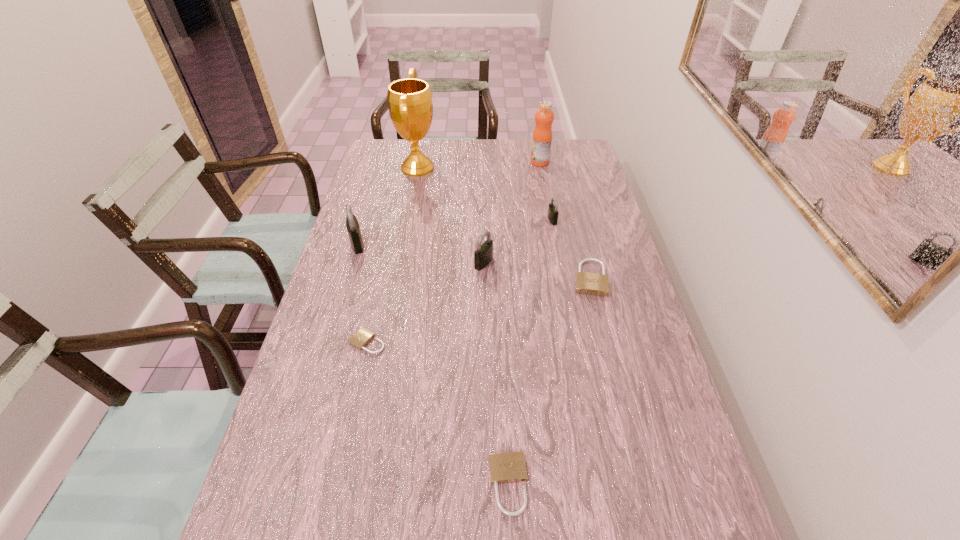
Find the location of a particular element. The image size is (960, 540). the fourth tallest padlock is located at coordinates tap(588, 283).

Identify the location of the second beige padlock from left to right. The height and width of the screenshot is (540, 960). (509, 467).

I want to click on the second shortest object, so click(509, 467).

Image resolution: width=960 pixels, height=540 pixels. Find the location of `the fifth farthest padlock`. the fifth farthest padlock is located at coordinates (363, 336).

At what (x,y) coordinates should I click in order to perform the action: click on the second nearest object. Please return your answer as a coordinate pair (x, y). Image resolution: width=960 pixels, height=540 pixels. Looking at the image, I should click on (363, 336).

This screenshot has height=540, width=960. What are the coordinates of `free spot located on the front-facing side of the tallest object` in the screenshot? It's located at (455, 168).

You are a GUI agent. You are given a task and a screenshot of the screen. Output one action in this format:
    pyautogui.click(x=<x>, y=<y>)
    Task: Click on the vacant space located on the left of the fruit juice
    The width and height of the screenshot is (960, 540).
    Given the screenshot: What is the action you would take?
    pyautogui.click(x=483, y=162)

The height and width of the screenshot is (540, 960). Identify the location of vacant area situated 0.360m on the front of the leftmost padlock. (326, 348).

Where is `vacant space located on the back of the fifth shortest object`? This screenshot has height=540, width=960. vacant space located on the back of the fifth shortest object is located at coordinates (483, 213).

The height and width of the screenshot is (540, 960). Find the location of `vacant space situated on the left of the smallest black padlock`. vacant space situated on the left of the smallest black padlock is located at coordinates (441, 220).